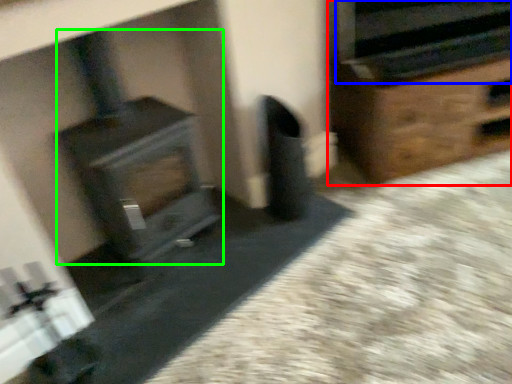
Question: Considering the real-world distances, which object is farthest from furniture (highlighted by a red box)? stereo (highlighted by a blue box) or wood burning stove (highlighted by a green box)?

Choices:
 (A) stereo
 (B) wood burning stove

Answer: (B)